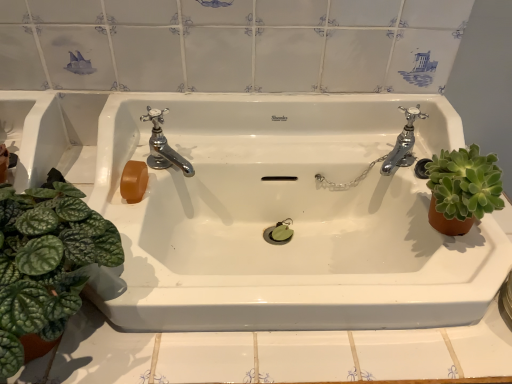
Question: Is green leafy plant at left, the 1th houseplant when ordered from left to right, outside of chrome metallic faucet at right, placed as the second tap when sorted from left to right?

Choices:
 (A) no
 (B) yes

Answer: (B)

Question: Is chrome metallic faucet at right, which is counted as the first tap, starting from the right, a part of green leafy plant at left, arranged as the 2th houseplant when viewed from the right?

Choices:
 (A) yes
 (B) no

Answer: (B)

Question: Is green leafy plant at left, arranged as the 2th houseplant when viewed from the right, next to chrome metallic faucet at right, placed as the second tap when sorted from left to right, and touching it?

Choices:
 (A) yes
 (B) no

Answer: (B)

Question: From a real-world perspective, is green leafy plant at left, the 1th houseplant when ordered from left to right, physically below chrome metallic faucet at right, placed as the second tap when sorted from left to right?

Choices:
 (A) no
 (B) yes

Answer: (A)

Question: Does green leafy plant at left, the 1th houseplant when ordered from left to right, appear on the left side of chrome metallic faucet at right, which is counted as the first tap, starting from the right?

Choices:
 (A) yes
 (B) no

Answer: (A)

Question: Would you say chrome metallic faucet at upper left, arranged as the first tap when viewed from the left, is to the left or to the right of white glossy sink at center in the picture?

Choices:
 (A) left
 (B) right

Answer: (A)

Question: Based on their sizes in the image, would you say chrome metallic faucet at upper left, arranged as the first tap when viewed from the left, is bigger or smaller than white glossy sink at center?

Choices:
 (A) small
 (B) big

Answer: (A)

Question: Is chrome metallic faucet at upper left, arranged as the first tap when viewed from the left, wider or thinner than white glossy sink at center?

Choices:
 (A) thin
 (B) wide

Answer: (A)

Question: Is point (158, 134) positioned closer to the camera than point (138, 241)?

Choices:
 (A) farther
 (B) closer

Answer: (A)

Question: In terms of height, does chrome metallic faucet at right, placed as the second tap when sorted from left to right, look taller or shorter compared to green leafy plant at left, the 1th houseplant when ordered from left to right?

Choices:
 (A) short
 (B) tall

Answer: (A)

Question: Is chrome metallic faucet at right, placed as the second tap when sorted from left to right, inside the boundaries of green leafy plant at left, arranged as the 2th houseplant when viewed from the right, or outside?

Choices:
 (A) outside
 (B) inside

Answer: (A)

Question: From the image's perspective, relative to green leafy plant at left, the 1th houseplant when ordered from left to right, is chrome metallic faucet at right, which is counted as the first tap, starting from the right, above or below?

Choices:
 (A) above
 (B) below

Answer: (A)

Question: Considering the relative positions of chrome metallic faucet at right, placed as the second tap when sorted from left to right, and green leafy plant at left, arranged as the 2th houseplant when viewed from the right, in the image provided, is chrome metallic faucet at right, placed as the second tap when sorted from left to right, to the left or to the right of green leafy plant at left, arranged as the 2th houseplant when viewed from the right,?

Choices:
 (A) left
 (B) right

Answer: (B)

Question: Is chrome metallic faucet at upper left, marked as the second tap in a right-to-left arrangement, wider or thinner than green leafy plant at left, the 1th houseplant when ordered from left to right?

Choices:
 (A) wide
 (B) thin

Answer: (B)

Question: From a real-world perspective, is chrome metallic faucet at upper left, marked as the second tap in a right-to-left arrangement, above or below green leafy plant at left, arranged as the 2th houseplant when viewed from the right?

Choices:
 (A) below
 (B) above

Answer: (A)